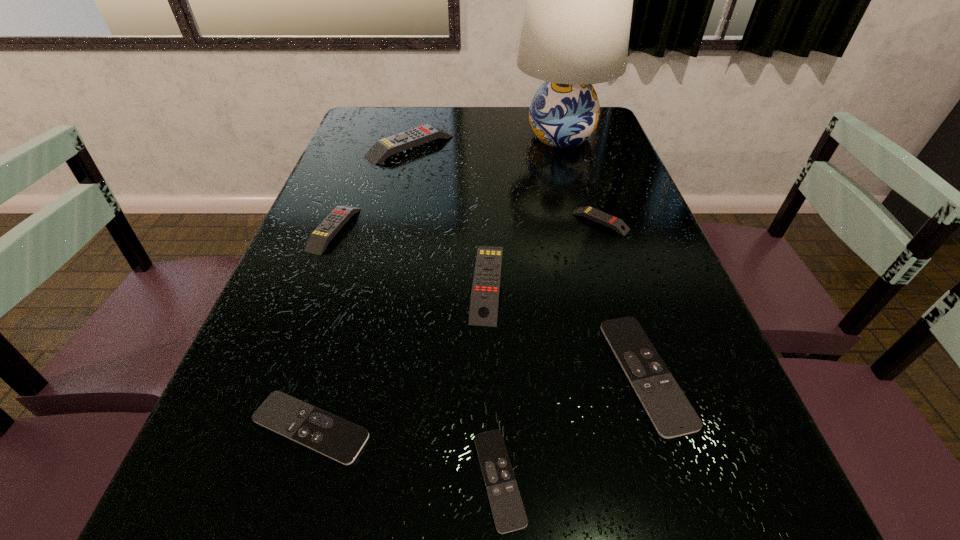
At what (x,y) coordinates should I click in order to perform the action: click on the rightmost black remote control. Please return your answer as a coordinate pair (x, y). This screenshot has width=960, height=540. Looking at the image, I should click on (672, 415).

Where is `the third shortest remote control`? This screenshot has height=540, width=960. the third shortest remote control is located at coordinates (672, 415).

Image resolution: width=960 pixels, height=540 pixels. Find the location of `the second smallest black remote control`. the second smallest black remote control is located at coordinates (321, 431).

You are a GUI agent. You are given a task and a screenshot of the screen. Output one action in this format:
    pyautogui.click(x=<x>, y=<y>)
    Task: Click on the leftmost black remote control
    Image resolution: width=960 pixels, height=540 pixels.
    Given the screenshot: What is the action you would take?
    (x=321, y=431)

Where is `the shortest remote control`? The height and width of the screenshot is (540, 960). the shortest remote control is located at coordinates coord(509,515).

Locate an element on the screen. This screenshot has width=960, height=540. the second black remote control from left to right is located at coordinates (509, 515).

This screenshot has width=960, height=540. What are the coordinates of `vacant position located 0.380m on the front-facing side of the blue lampshade` in the screenshot? It's located at (395, 136).

Locate an element on the screen. This screenshot has width=960, height=540. vacant area situated 0.290m on the front-facing side of the blue lampshade is located at coordinates (422, 136).

I want to click on vacant space located on the front-facing side of the blue lampshade, so click(x=454, y=136).

The width and height of the screenshot is (960, 540). Identify the location of vacant space located 0.230m on the front of the tallest remote control. coord(395,211).